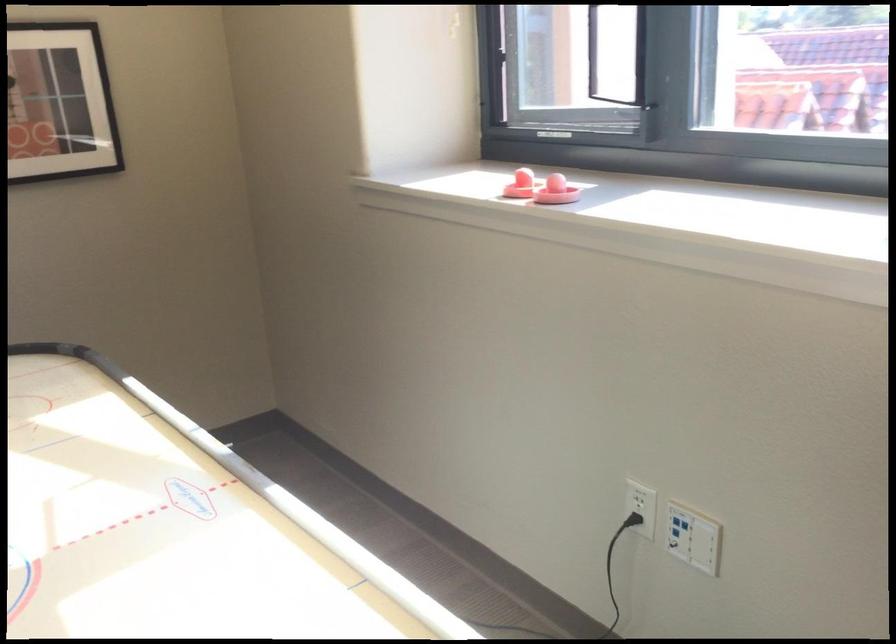
Locate an element on the screen. black power plug is located at coordinates (631, 523).